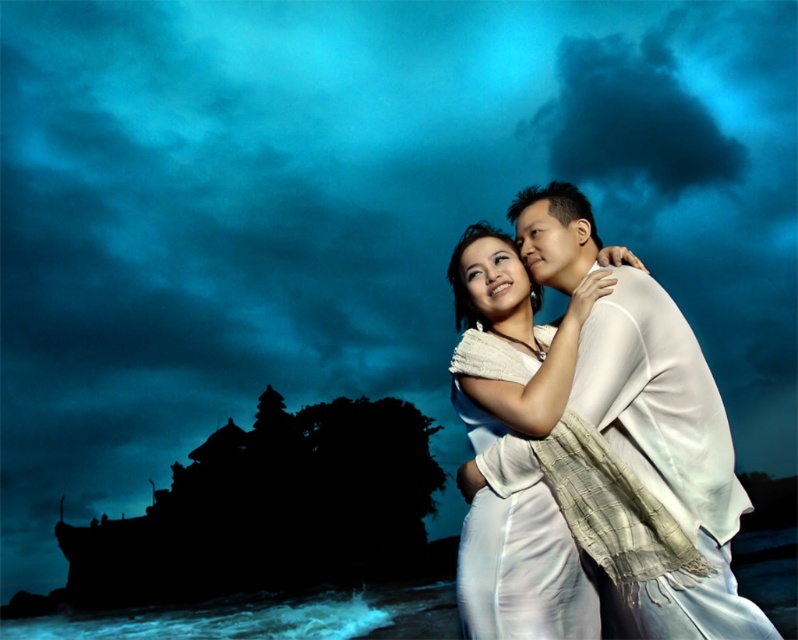
Question: Which object appears farthest from the camera in this image?

Choices:
 (A) white sheer fabric couple at center
 (B) white silk dress at center

Answer: (B)

Question: Does white sheer fabric couple at center appear over white silk dress at center?

Choices:
 (A) yes
 (B) no

Answer: (B)

Question: Which object appears farthest from the camera in this image?

Choices:
 (A) white sheer fabric couple at center
 (B) white silk dress at center

Answer: (B)

Question: Which point is closer to the camera?

Choices:
 (A) (538, 401)
 (B) (731, 616)

Answer: (B)

Question: Does white sheer fabric couple at center come behind white silk dress at center?

Choices:
 (A) no
 (B) yes

Answer: (A)

Question: Is white sheer fabric couple at center in front of white silk dress at center?

Choices:
 (A) yes
 (B) no

Answer: (A)